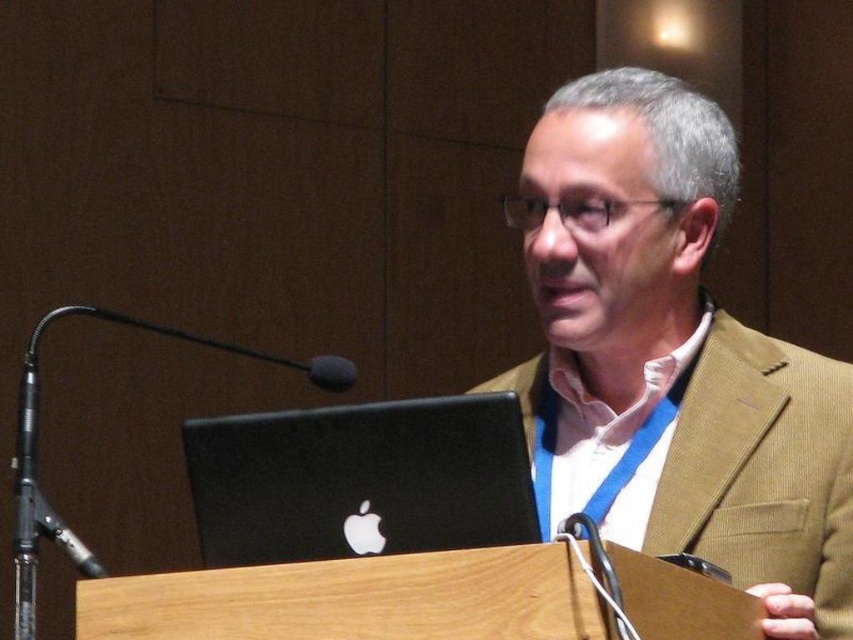
Who is more forward, (604,440) or (294,522)?

Point (294,522)

Is point (614, 193) more distant than point (357, 518)?

Yes, point (614, 193) is behind point (357, 518).

Image resolution: width=853 pixels, height=640 pixels. In order to click on matte brown suit at center in this screenshot , I will do `click(672, 358)`.

I want to click on matte brown suit at center, so click(672, 358).